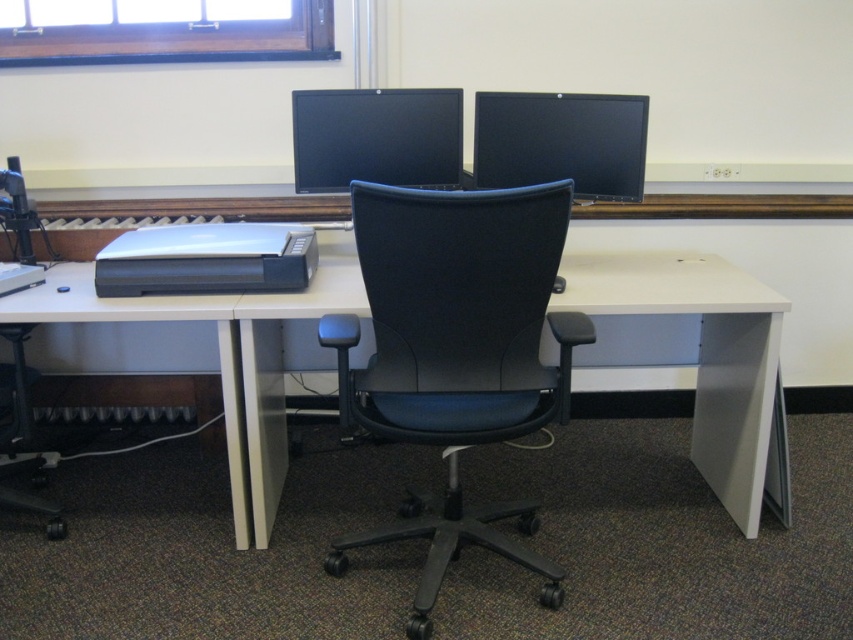
Is black fabric swivel chair at center thinner than matte black monitor at upper center?

In fact, black fabric swivel chair at center might be wider than matte black monitor at upper center.

Between black fabric swivel chair at center and matte black monitor at upper center, which one appears on the left side from the viewer's perspective?

Positioned to the left is black fabric swivel chair at center.

You are a GUI agent. You are given a task and a screenshot of the screen. Output one action in this format:
    pyautogui.click(x=<x>, y=<y>)
    Task: Click on the black fabric swivel chair at center
    
    Given the screenshot: What is the action you would take?
    pyautogui.click(x=456, y=353)

Between matte black monitor at upper center and black glossy monitor at center, which one has less height?

black glossy monitor at center

Can you confirm if matte black monitor at upper center is thinner than black glossy monitor at center?

Yes, matte black monitor at upper center is thinner than black glossy monitor at center.

Does point (509, 148) come in front of point (434, 99)?

No, (509, 148) is further to viewer.

At what (x,y) coordinates should I click in order to perform the action: click on matte black monitor at upper center. Please return your answer as a coordinate pair (x, y). This screenshot has height=640, width=853. Looking at the image, I should click on (561, 141).

Can you confirm if black fabric swivel chair at center is taller than silver/black printer at center?

Correct, black fabric swivel chair at center is much taller as silver/black printer at center.

Does point (428, 342) lie behind point (190, 227)?

No.

Who is more distant from viewer, (x=345, y=426) or (x=244, y=288)?

The point (x=244, y=288) is more distant.

Where is `black fabric swivel chair at center`? The width and height of the screenshot is (853, 640). black fabric swivel chair at center is located at coordinates (456, 353).